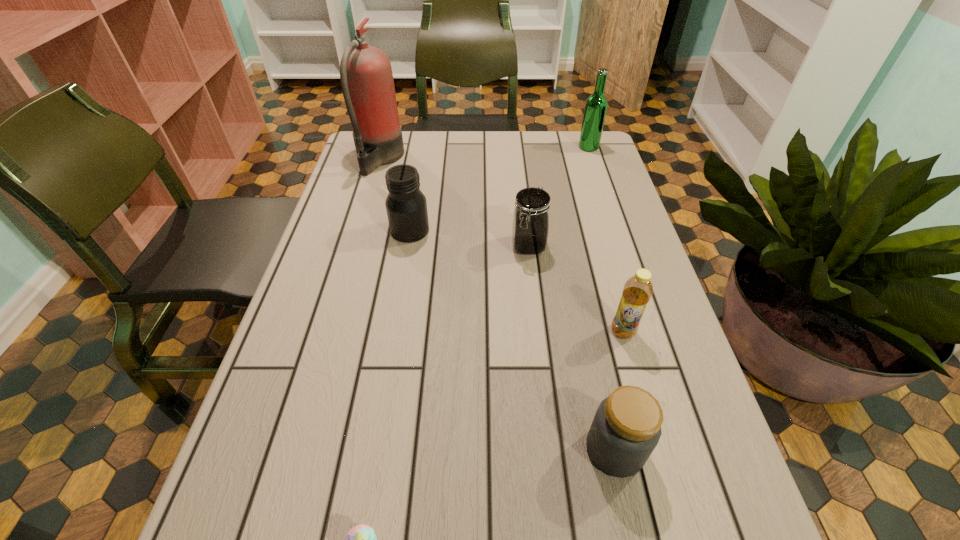
This screenshot has width=960, height=540. I want to click on free space located on the front of the leftmost jar, so click(393, 331).

The height and width of the screenshot is (540, 960). I want to click on free space located 0.350m on the front of the bottle, so click(x=681, y=537).

In order to click on vacant space located on the lid of the fourth object from left to right in this screenshot , I will do `click(546, 407)`.

Locate an element on the screen. free point located on the surface of the nearest jar near the warning symbol is located at coordinates (472, 449).

The image size is (960, 540). Find the location of `vacant space located 0.230m on the surface of the nearest jar near the warning symbol`. vacant space located 0.230m on the surface of the nearest jar near the warning symbol is located at coordinates (448, 449).

The image size is (960, 540). I want to click on free space located on the surface of the nearest jar near the warning symbol, so click(x=491, y=449).

Where is `fire extinguisher that is positioned at the far edge`? Image resolution: width=960 pixels, height=540 pixels. fire extinguisher that is positioned at the far edge is located at coordinates (366, 76).

Image resolution: width=960 pixels, height=540 pixels. I want to click on beer bottle at the far edge, so click(596, 105).

Locate an element on the screen. The image size is (960, 540). object situated at the left edge is located at coordinates (366, 76).

Locate an element on the screen. beer bottle that is at the right edge is located at coordinates [x=596, y=105].